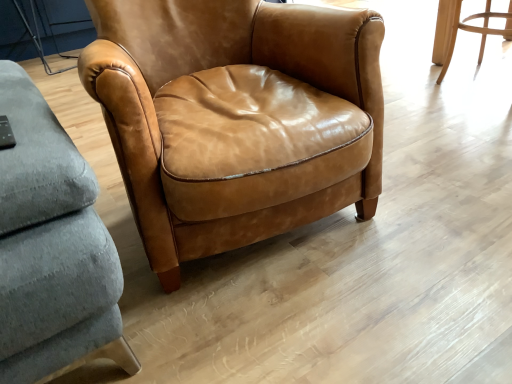
You are a GUI agent. You are given a task and a screenshot of the screen. Output one action in this format:
    pyautogui.click(x=<x>, y=<y>)
    Task: Click on the matte leather chair at center, the second chair in the right-to-left sequence
    The image size is (512, 384).
    Given the screenshot: What is the action you would take?
    pyautogui.click(x=193, y=89)

What do you see at coordinates (193, 89) in the screenshot? The width and height of the screenshot is (512, 384). I see `matte leather chair at center, which appears as the 2th chair when viewed from the back` at bounding box center [193, 89].

Where is `matte brown leather chair at center, acting as the 1th chair starting from the back`? The height and width of the screenshot is (384, 512). matte brown leather chair at center, acting as the 1th chair starting from the back is located at coordinates (473, 31).

Measure the distance between matte brown leather chair at center, the 2th chair from the left, and camera.

The distance of matte brown leather chair at center, the 2th chair from the left, from camera is 2.25 meters.

The width and height of the screenshot is (512, 384). Describe the element at coordinates (473, 31) in the screenshot. I see `matte brown leather chair at center, marked as the second chair in a front-to-back arrangement` at that location.

This screenshot has height=384, width=512. Identify the location of matte leather chair at center, the second chair in the right-to-left sequence. (193, 89).

Can you confirm if matte leather chair at center, placed as the 1th chair when sorted from left to right, is positioned to the left of matte brown leather chair at center, the 2th chair from the left?

Yes.

Is matte leather chair at center, which appears as the 2th chair when viewed from the back, behind matte brown leather chair at center, acting as the 1th chair starting from the back?

No, matte leather chair at center, which appears as the 2th chair when viewed from the back, is closer to the viewer.

Is point (309, 10) in front of point (448, 66)?

Yes, it is in front of point (448, 66).

From the image's perspective, which one is positioned higher, matte leather chair at center, the second chair in the right-to-left sequence, or matte brown leather chair at center, acting as the 1th chair starting from the back?

matte brown leather chair at center, acting as the 1th chair starting from the back, appears higher in the image.

In the scene shown: From a real-world perspective, is matte leather chair at center, the second chair in the right-to-left sequence, located beneath matte brown leather chair at center, acting as the 1th chair starting from the back?

No.

Can you confirm if matte leather chair at center, which appears as the 2th chair when viewed from the back, is thinner than matte brown leather chair at center, acting as the 1th chair starting from the back?

No, matte leather chair at center, which appears as the 2th chair when viewed from the back, is not thinner than matte brown leather chair at center, acting as the 1th chair starting from the back.

Which of these two, matte leather chair at center, placed as the 1th chair when sorted from left to right, or matte brown leather chair at center, acting as the 1th chair starting from the back, stands shorter?

matte brown leather chair at center, acting as the 1th chair starting from the back, is shorter.

Between matte leather chair at center, arranged as the first chair when viewed from the front, and matte brown leather chair at center, the 2th chair from the left, which one has smaller size?

matte brown leather chair at center, the 2th chair from the left.

Is matte brown leather chair at center, acting as the 1th chair starting from the back, a part of matte leather chair at center, arranged as the first chair when viewed from the front?

No, matte brown leather chair at center, acting as the 1th chair starting from the back, is not surrounded by matte leather chair at center, arranged as the first chair when viewed from the front.

Are matte leather chair at center, the second chair in the right-to-left sequence, and matte brown leather chair at center, marked as the second chair in a front-to-back arrangement, located far from each other?

matte leather chair at center, the second chair in the right-to-left sequence, is far away from matte brown leather chair at center, marked as the second chair in a front-to-back arrangement.

Is matte leather chair at center, the second chair in the right-to-left sequence, oriented away from matte brown leather chair at center, marked as the second chair in a front-to-back arrangement?

No, matte leather chair at center, the second chair in the right-to-left sequence, is not facing the opposite direction of matte brown leather chair at center, marked as the second chair in a front-to-back arrangement.

How distant is matte leather chair at center, the second chair in the right-to-left sequence, from matte brown leather chair at center, acting as the 1th chair starting from the right?

matte leather chair at center, the second chair in the right-to-left sequence, and matte brown leather chair at center, acting as the 1th chair starting from the right, are 5.18 feet apart from each other.

Find the location of a particular element. chair on the right of matte leather chair at center, which appears as the 2th chair when viewed from the back is located at coordinates (473, 31).

Is matte brown leather chair at center, marked as the second chair in a front-to-back arrangement, at the left side of matte leather chair at center, arranged as the first chair when viewed from the front?

No.

Is matte brown leather chair at center, acting as the 1th chair starting from the back, positioned before matte leather chair at center, the second chair in the right-to-left sequence?

No.

Does point (482, 32) lie behind point (253, 48)?

Yes, it is.

From the image's perspective, which object appears higher, matte brown leather chair at center, acting as the 1th chair starting from the right, or matte leather chair at center, placed as the 1th chair when sorted from left to right?

matte brown leather chair at center, acting as the 1th chair starting from the right.

From a real-world perspective, is matte brown leather chair at center, acting as the 1th chair starting from the back, below matte leather chair at center, which appears as the 2th chair when viewed from the back?

Yes, from a real-world perspective, matte brown leather chair at center, acting as the 1th chair starting from the back, is under matte leather chair at center, which appears as the 2th chair when viewed from the back.

Is matte brown leather chair at center, the 2th chair from the left, wider than matte leather chair at center, which appears as the 2th chair when viewed from the back?

No, matte brown leather chair at center, the 2th chair from the left, is not wider than matte leather chair at center, which appears as the 2th chair when viewed from the back.

From their relative heights in the image, would you say matte brown leather chair at center, the 2th chair from the left, is taller or shorter than matte leather chair at center, arranged as the first chair when viewed from the front?

Clearly, matte brown leather chair at center, the 2th chair from the left, is shorter compared to matte leather chair at center, arranged as the first chair when viewed from the front.

Considering the relative sizes of matte brown leather chair at center, acting as the 1th chair starting from the back, and matte leather chair at center, the second chair in the right-to-left sequence, in the image provided, is matte brown leather chair at center, acting as the 1th chair starting from the back, bigger than matte leather chair at center, the second chair in the right-to-left sequence,?

Actually, matte brown leather chair at center, acting as the 1th chair starting from the back, might be smaller than matte leather chair at center, the second chair in the right-to-left sequence.

Is matte leather chair at center, the second chair in the right-to-left sequence, located within matte brown leather chair at center, acting as the 1th chair starting from the right?

That's incorrect, matte leather chair at center, the second chair in the right-to-left sequence, is not inside matte brown leather chair at center, acting as the 1th chair starting from the right.

Does matte brown leather chair at center, the 2th chair from the left, touch matte leather chair at center, placed as the 1th chair when sorted from left to right?

No, matte brown leather chair at center, the 2th chair from the left, is not touching matte leather chair at center, placed as the 1th chair when sorted from left to right.

Is matte brown leather chair at center, marked as the second chair in a front-to-back arrangement, oriented away from matte leather chair at center, arranged as the first chair when viewed from the front?

Yes, matte brown leather chair at center, marked as the second chair in a front-to-back arrangement, is facing away from matte leather chair at center, arranged as the first chair when viewed from the front.

This screenshot has height=384, width=512. I want to click on chair below the matte brown leather chair at center, marked as the second chair in a front-to-back arrangement (from the image's perspective), so click(x=193, y=89).

Where is `chair located on the right of matte leather chair at center, the second chair in the right-to-left sequence`? chair located on the right of matte leather chair at center, the second chair in the right-to-left sequence is located at coordinates (473, 31).

Where is `chair lying in front of the matte brown leather chair at center, marked as the second chair in a front-to-back arrangement`? The height and width of the screenshot is (384, 512). chair lying in front of the matte brown leather chair at center, marked as the second chair in a front-to-back arrangement is located at coordinates (193, 89).